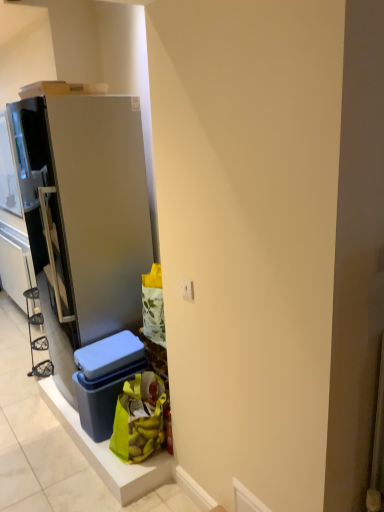
What do you see at coordinates (139, 418) in the screenshot?
I see `green fabric bag at lower center` at bounding box center [139, 418].

What is the approximate height of white plastic electric outlet at center?

The height of white plastic electric outlet at center is 8.78 centimeters.

Locate an element on the screen. This screenshot has height=512, width=384. matte blue plastic storage box at lower center is located at coordinates (105, 381).

What do you see at coordinates (90, 201) in the screenshot? This screenshot has width=384, height=512. I see `satin silver refrigerator at left` at bounding box center [90, 201].

I want to click on green fabric bag at lower center, so click(139, 418).

Which object is positioned more to the right, green fabric bag at lower center or white plastic electric outlet at center?

white plastic electric outlet at center is more to the right.

Can you confirm if green fabric bag at lower center is shorter than white plastic electric outlet at center?

No, green fabric bag at lower center is not shorter than white plastic electric outlet at center.

From a real-world perspective, is green fabric bag at lower center under white plastic electric outlet at center?

Indeed, from a real-world perspective, green fabric bag at lower center is positioned beneath white plastic electric outlet at center.

Looking at their sizes, would you say green fabric bag at lower center is wider or thinner than white plastic electric outlet at center?

In the image, green fabric bag at lower center appears to be wider than white plastic electric outlet at center.

Can you confirm if matte blue plastic storage box at lower center is shorter than satin silver refrigerator at left?

Indeed, matte blue plastic storage box at lower center has a lesser height compared to satin silver refrigerator at left.

Considering the relative positions of matte blue plastic storage box at lower center and satin silver refrigerator at left in the image provided, is matte blue plastic storage box at lower center behind satin silver refrigerator at left?

Yes, the depth of matte blue plastic storage box at lower center is greater than that of satin silver refrigerator at left.

From the image's perspective, which is below, matte blue plastic storage box at lower center or satin silver refrigerator at left?

matte blue plastic storage box at lower center is shown below in the image.

From the picture: Considering the relative sizes of matte blue plastic storage box at lower center and satin silver refrigerator at left in the image provided, is matte blue plastic storage box at lower center bigger than satin silver refrigerator at left?

Actually, matte blue plastic storage box at lower center might be smaller than satin silver refrigerator at left.

Is satin silver refrigerator at left facing away from matte blue plastic storage box at lower center?

That's not correct — satin silver refrigerator at left is not looking away from matte blue plastic storage box at lower center.

Which is farther from the camera, (104,320) or (96,403)?

The point (104,320) is farther.

Looking at this image, considering the relative sizes of satin silver refrigerator at left and matte blue plastic storage box at lower center in the image provided, is satin silver refrigerator at left wider than matte blue plastic storage box at lower center?

Yes, satin silver refrigerator at left is wider than matte blue plastic storage box at lower center.

At what (x,y) coordinates should I click in order to perform the action: click on storage box to the right of satin silver refrigerator at left. Please return your answer as a coordinate pair (x, y). The width and height of the screenshot is (384, 512). Looking at the image, I should click on (105, 381).

Could you tell me if white plastic electric outlet at center is facing green fabric bag at lower center?

No, white plastic electric outlet at center is not oriented towards green fabric bag at lower center.

Is white plastic electric outlet at center outside of green fabric bag at lower center?

Yes, white plastic electric outlet at center is outside of green fabric bag at lower center.

Which is more to the left, white plastic electric outlet at center or green fabric bag at lower center?

Positioned to the left is green fabric bag at lower center.

Relative to green fabric bag at lower center, is white plastic electric outlet at center in front or behind?

Visually, white plastic electric outlet at center is located in front of green fabric bag at lower center.

From the image's perspective, which one is positioned higher, satin silver refrigerator at left or white plastic electric outlet at center?

satin silver refrigerator at left appears higher in the image.

From the picture: Which of these two, satin silver refrigerator at left or white plastic electric outlet at center, stands taller?

satin silver refrigerator at left is taller.

Considering their positions, is satin silver refrigerator at left located in front of or behind white plastic electric outlet at center?

In the image, satin silver refrigerator at left appears behind white plastic electric outlet at center.

Which is more to the right, satin silver refrigerator at left or white plastic electric outlet at center?

From the viewer's perspective, white plastic electric outlet at center appears more on the right side.

From a real-world perspective, who is located lower, white plastic electric outlet at center or satin silver refrigerator at left?

satin silver refrigerator at left.

Between white plastic electric outlet at center and satin silver refrigerator at left, which one appears on the left side from the viewer's perspective?

satin silver refrigerator at left.

Identify the location of electric outlet that appears above the satin silver refrigerator at left (from a real-world perspective). (187, 290).

From the image's perspective, which is above, matte blue plastic storage box at lower center or white plastic electric outlet at center?

From the image's view, white plastic electric outlet at center is above.

Does point (97, 360) appear closer or farther from the camera than point (180, 282)?

Point (97, 360) appears to be farther away from the viewer than point (180, 282).

Is white plastic electric outlet at center at the back of matte blue plastic storage box at lower center?

No.

Considering the positions of objects matte blue plastic storage box at lower center and white plastic electric outlet at center in the image provided, who is more to the left, matte blue plastic storage box at lower center or white plastic electric outlet at center?

From the viewer's perspective, matte blue plastic storage box at lower center appears more on the left side.

I want to click on electric outlet above the green fabric bag at lower center (from the image's perspective), so click(x=187, y=290).

At what (x,y) coordinates should I click in order to perform the action: click on storage box below the satin silver refrigerator at left (from a real-world perspective). Please return your answer as a coordinate pair (x, y). This screenshot has width=384, height=512. Looking at the image, I should click on (x=105, y=381).

Considering their positions, is satin silver refrigerator at left positioned further to white plastic electric outlet at center than matte blue plastic storage box at lower center?

Among the two, satin silver refrigerator at left is located further to white plastic electric outlet at center.

Based on their spatial positions, is matte blue plastic storage box at lower center or white plastic electric outlet at center closer to satin silver refrigerator at left?

matte blue plastic storage box at lower center.

Which object lies further to the anchor point satin silver refrigerator at left, green fabric bag at lower center or white plastic electric outlet at center?

white plastic electric outlet at center.

From the picture: Considering their positions, is satin silver refrigerator at left positioned further to green fabric bag at lower center than white plastic electric outlet at center?

white plastic electric outlet at center is further to green fabric bag at lower center.

Looking at the image, which one is located further to white plastic electric outlet at center, satin silver refrigerator at left or green fabric bag at lower center?

satin silver refrigerator at left.

Estimate the real-world distances between objects in this image. Which object is closer to green fabric bag at lower center, matte blue plastic storage box at lower center or white plastic electric outlet at center?

matte blue plastic storage box at lower center.

When comparing their distances from matte blue plastic storage box at lower center, does green fabric bag at lower center or white plastic electric outlet at center seem further?

white plastic electric outlet at center.

Considering their positions, is satin silver refrigerator at left positioned further to matte blue plastic storage box at lower center than white plastic electric outlet at center?

Based on the image, white plastic electric outlet at center appears to be further to matte blue plastic storage box at lower center.

This screenshot has width=384, height=512. What are the coordinates of `electric outlet between satin silver refrigerator at left and matte blue plastic storage box at lower center from top to bottom` in the screenshot? It's located at (187, 290).

The width and height of the screenshot is (384, 512). Identify the location of storage box between white plastic electric outlet at center and green fabric bag at lower center in the vertical direction. (105, 381).

You are a GUI agent. You are given a task and a screenshot of the screen. Output one action in this format:
    pyautogui.click(x=<x>, y=<y>)
    Task: Click on the storage box between satin silver refrigerator at left and green fabric bag at lower center vertically
    
    Given the screenshot: What is the action you would take?
    pyautogui.click(x=105, y=381)

At what (x,y) coordinates should I click in order to perform the action: click on electric outlet between satin silver refrigerator at left and green fabric bag at lower center vertically. Please return your answer as a coordinate pair (x, y). The width and height of the screenshot is (384, 512). Looking at the image, I should click on (187, 290).